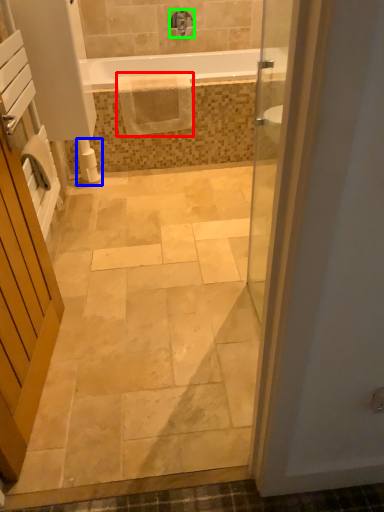
Question: Which is nearer to the material (highlighted by a red box)? toilet paper (highlighted by a blue box) or tap (highlighted by a green box).

Choices:
 (A) toilet paper
 (B) tap

Answer: (A)